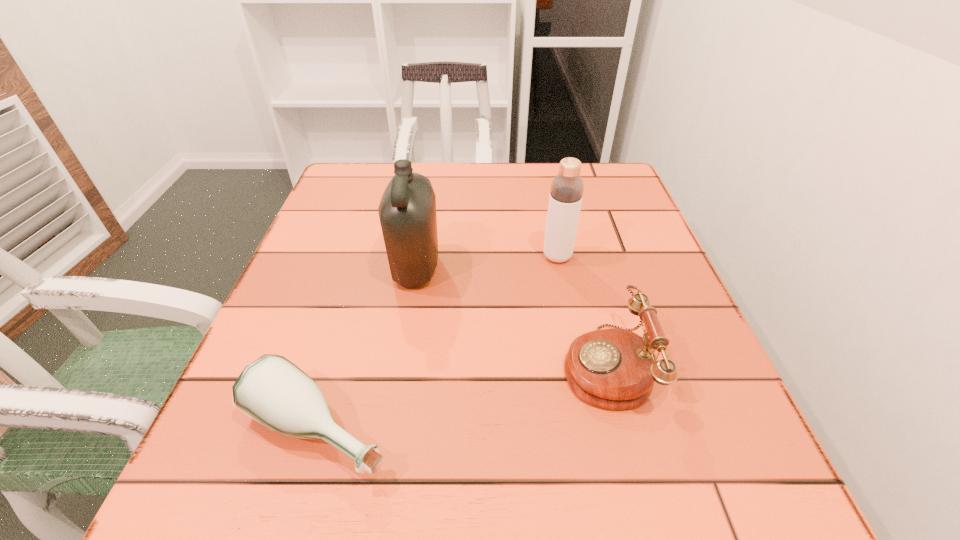
This screenshot has width=960, height=540. What are the coordinates of `free space between the telephone and the shortest bottle` in the screenshot? It's located at (462, 397).

Image resolution: width=960 pixels, height=540 pixels. In order to click on vacant area that lies between the nearest bottle and the rightmost bottle in this screenshot , I will do `click(438, 343)`.

The height and width of the screenshot is (540, 960). What are the coordinates of `vacant point located between the nearest bottle and the second shortest object` in the screenshot? It's located at (462, 397).

This screenshot has width=960, height=540. I want to click on object identified as the closest to the second shortest object, so click(x=567, y=187).

I want to click on object that stands as the third closest to the shortest bottle, so click(567, 187).

You are a GUI agent. You are given a task and a screenshot of the screen. Output one action in this format:
    pyautogui.click(x=<x>, y=<y>)
    Task: Click on the bottle that stands as the closest to the rightmost bottle
    Image resolution: width=960 pixels, height=540 pixels.
    Given the screenshot: What is the action you would take?
    pyautogui.click(x=407, y=211)

Locate which bottle is the second closest to the shortest bottle. Please provide its 2D coordinates. Your answer should be formatted as a tuple, i.e. [(x, y)], where the tuple contains the x and y coordinates of a point satisfying the conditions above.

[(567, 187)]

At what (x,y) coordinates should I click in order to perform the action: click on free point that satisfies the following two spatial constraints: 1. on the back side of the shortest object; 2. on the left side of the rightmost bottle. Please return your answer as a coordinate pair (x, y). Looking at the image, I should click on (369, 256).